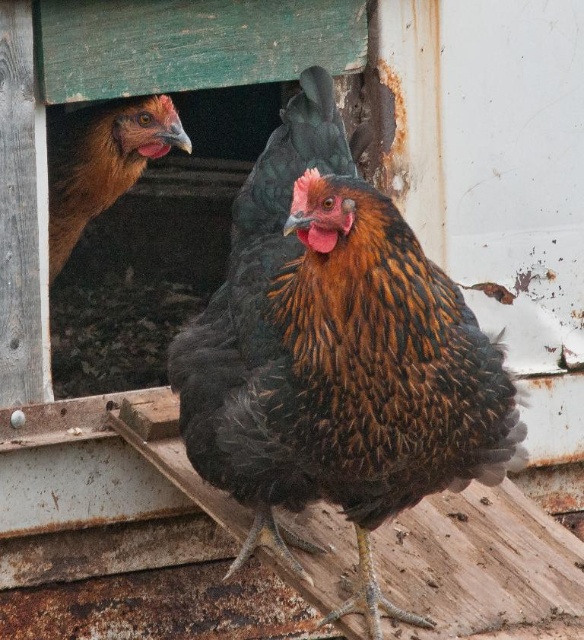
You are a farmer checking the coop. You need to identify which chicken is larger. Which one is bigger between the brown speckled feathered chicken at center and the brown feathered chicken at upper left?

The brown speckled feathered chicken at center is bigger than the brown feathered chicken at upper left.

You are a farmer checking the coop. You need to determine which chicken is taller between the brown speckled feathered chicken at center and the brown feathered chicken at upper left. Which one is taller?

The brown speckled feathered chicken at center is taller than the brown feathered chicken at upper left according to the description.